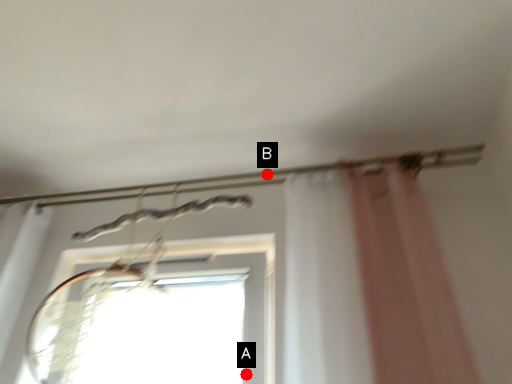
Question: Two points are circled on the image, labeled by A and B beside each circle. Which point is closer to the camera?

Choices:
 (A) A is closer
 (B) B is closer

Answer: (A)